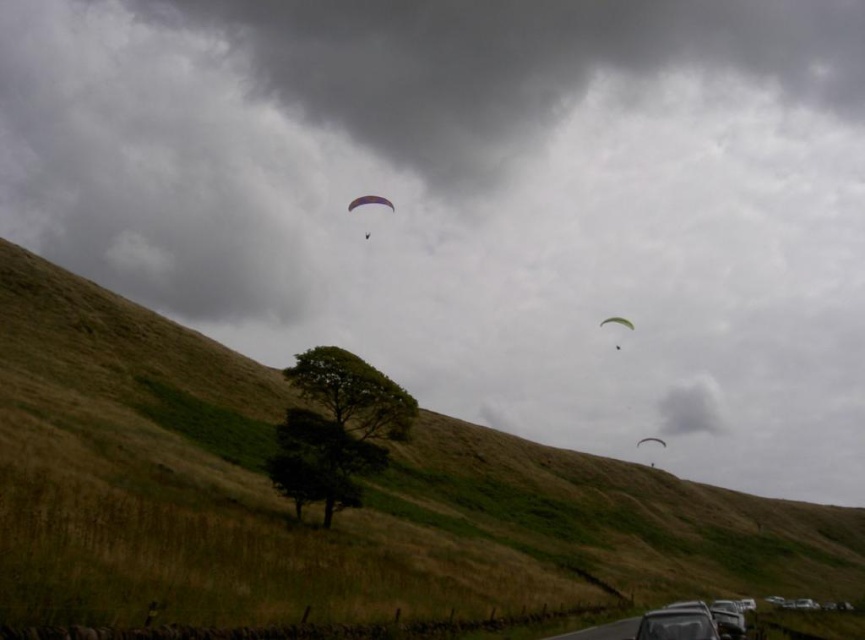
You are a hiker standing on the hill covered with dry, golden brown grass. You see the purple fabric parachute at center and the green fabric parachute at center. Which parachute is higher in the sky?

The purple fabric parachute at center is positioned over the green fabric parachute at center, so it is higher in the sky.